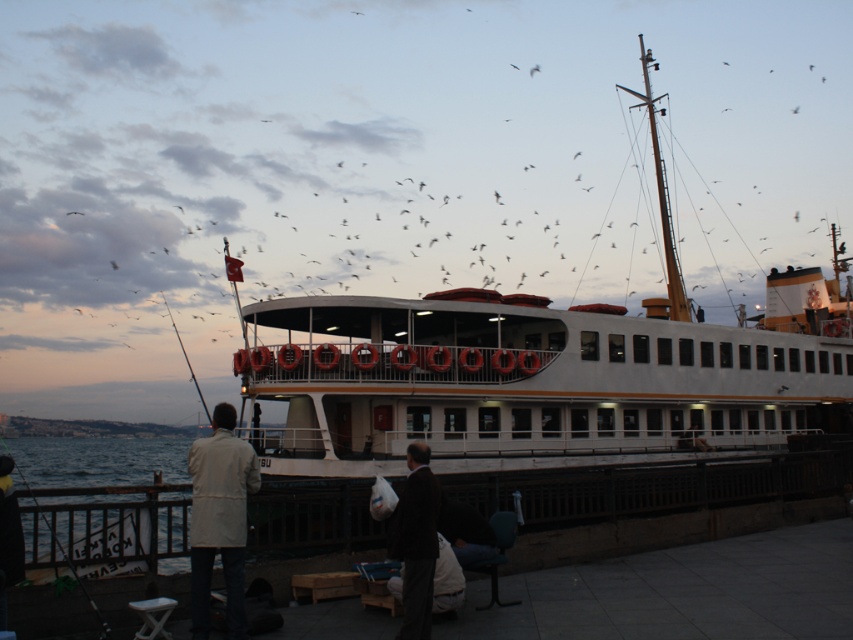
Which of these two, white matte jacket at lower left or white cotton jacket at lower left, stands shorter?

white cotton jacket at lower left is shorter.

Can you confirm if white matte jacket at lower left is shorter than white cotton jacket at lower left?

No, white matte jacket at lower left is not shorter than white cotton jacket at lower left.

The image size is (853, 640). What do you see at coordinates (219, 518) in the screenshot?
I see `white matte jacket at lower left` at bounding box center [219, 518].

Where is `white matte jacket at lower left`? The height and width of the screenshot is (640, 853). white matte jacket at lower left is located at coordinates (219, 518).

Who is more distant from viewer, [1,465] or [167,308]?

Point [167,308]

Can you confirm if white cotton jacket at lower left is wider than metallic fishing pole at upper left?

No, white cotton jacket at lower left is not wider than metallic fishing pole at upper left.

The width and height of the screenshot is (853, 640). What do you see at coordinates (9, 538) in the screenshot?
I see `white cotton jacket at lower left` at bounding box center [9, 538].

Find the location of a particular element. white cotton jacket at lower left is located at coordinates 9,538.

Which is more to the left, white matte jacket at lower left or dark brown suit at center?

white matte jacket at lower left is more to the left.

Who is more forward, (235, 628) or (397, 557)?

Point (235, 628)

Locate an element on the screen. This screenshot has height=640, width=853. white matte jacket at lower left is located at coordinates (219, 518).

You are a GUI agent. You are given a task and a screenshot of the screen. Output one action in this format:
    pyautogui.click(x=<x>, y=<y>)
    Task: Click on the white matte jacket at lower left
    The width and height of the screenshot is (853, 640).
    Given the screenshot: What is the action you would take?
    219,518